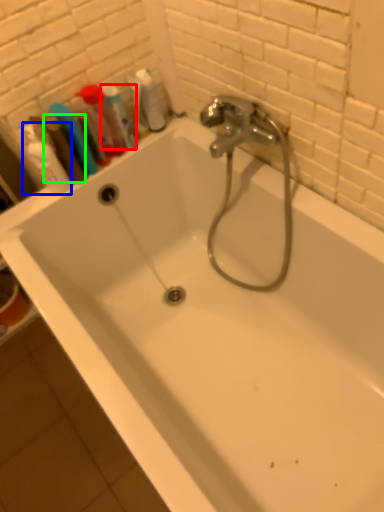
Question: Which object is the farthest from mouthwash (highlighted by a red box)? Choose among these: shaving cream (highlighted by a blue box) or mouthwash (highlighted by a green box).

Choices:
 (A) shaving cream
 (B) mouthwash

Answer: (A)